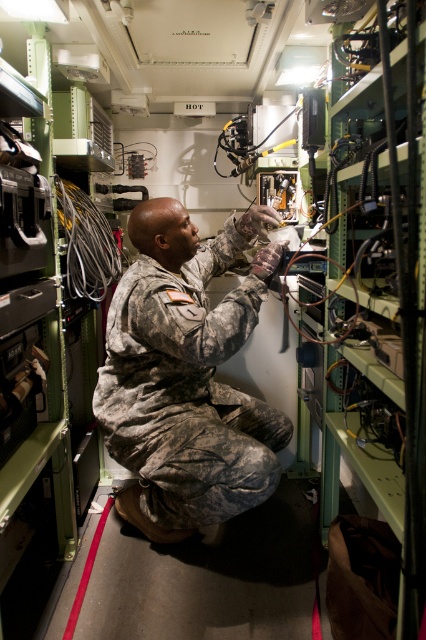
Question: In this image, where is camouflage fabric uniform at center located relative to black rubber wire at center?

Choices:
 (A) below
 (B) above

Answer: (A)

Question: Which point is farther from the camera taking this photo?

Choices:
 (A) (103, 230)
 (B) (204, 394)

Answer: (A)

Question: Which point is farther from the camera taking this photo?

Choices:
 (A) (235, 420)
 (B) (63, 211)

Answer: (A)

Question: Is camouflage fabric uniform at center smaller than black rubber wire at center?

Choices:
 (A) yes
 (B) no

Answer: (B)

Question: Does camouflage fabric uniform at center appear on the right side of black rubber wire at center?

Choices:
 (A) yes
 (B) no

Answer: (A)